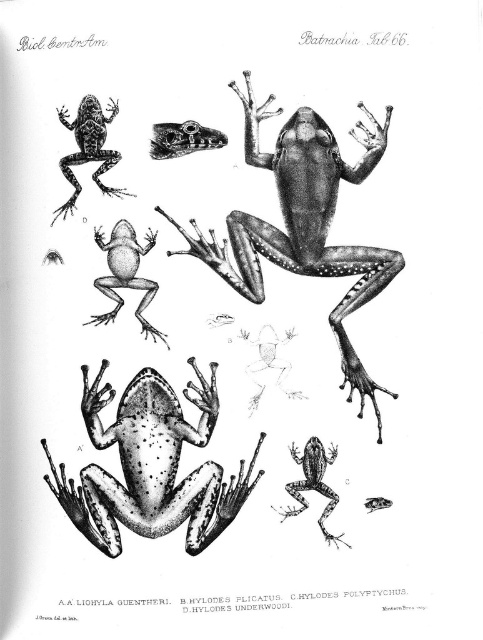
You are an entomologist examining the frog illustration. You notice two points marked on the frog. Point A is at coordinates point (316, 234) and Point B is at point (156, 282). From your perspective, which point is closer to you?

Point A at point (316, 234) is closer to you because it is in front of point B at point (156, 282).

You are a biologist examining the illustration. You need to compare the sizes of the smooth black frog at center and the spotted matte frog at upper left. Based on their positions in the image, which frog is wider?

The smooth black frog at center is wider than the spotted matte frog at upper left because its width surpasses the latter.

Based on the illustration, which frog is placed higher up in the image? The smooth gray frog at center or the speckled skin frog at lower right?

The smooth gray frog at center is positioned over the speckled skin frog at lower right, so it is placed higher up in the image.